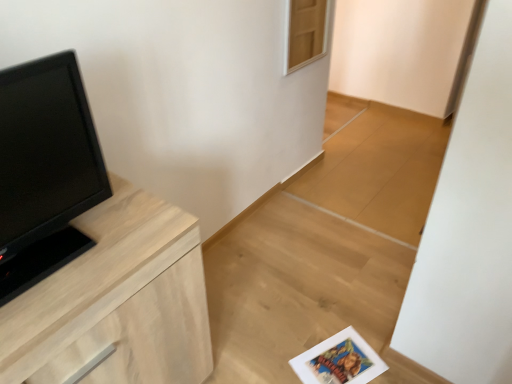
What do you see at coordinates (45, 170) in the screenshot? I see `black matte tv at left` at bounding box center [45, 170].

The height and width of the screenshot is (384, 512). In order to click on black matte tv at left in this screenshot , I will do `click(45, 170)`.

What are the coordinates of `light wood chest of drawers at left` in the screenshot? It's located at (117, 301).

What do you see at coordinates (117, 301) in the screenshot? The width and height of the screenshot is (512, 384). I see `light wood chest of drawers at left` at bounding box center [117, 301].

Consider the image. Measure the distance between light wood chest of drawers at left and camera.

The distance of light wood chest of drawers at left from camera is 30.24 inches.

The height and width of the screenshot is (384, 512). I want to click on black matte tv at left, so click(x=45, y=170).

Between black matte tv at left and light wood chest of drawers at left, which one appears on the right side from the viewer's perspective?

light wood chest of drawers at left.

Is black matte tv at left behind light wood chest of drawers at left?

No, black matte tv at left is closer to the camera.

Which point is more distant from viewer, (70, 127) or (203, 292)?

Point (203, 292)

From the image's perspective, which object appears higher, black matte tv at left or light wood chest of drawers at left?

From the image's view, black matte tv at left is above.

From a real-world perspective, is black matte tv at left above or below light wood chest of drawers at left?

In terms of real-world spatial position, black matte tv at left is above light wood chest of drawers at left.

Considering the relative sizes of black matte tv at left and light wood chest of drawers at left in the image provided, is black matte tv at left thinner than light wood chest of drawers at left?

Correct, the width of black matte tv at left is less than that of light wood chest of drawers at left.

Between black matte tv at left and light wood chest of drawers at left, which one has more height?

Standing taller between the two is light wood chest of drawers at left.

Looking at this image, looking at the image, does black matte tv at left seem bigger or smaller compared to light wood chest of drawers at left?

Clearly, black matte tv at left is smaller in size than light wood chest of drawers at left.

Is light wood chest of drawers at left completely or partially inside black matte tv at left?

No, light wood chest of drawers at left is not surrounded by black matte tv at left.

Is black matte tv at left far from light wood chest of drawers at left?

No.

Is black matte tv at left looking in the opposite direction of light wood chest of drawers at left?

No, black matte tv at left is not facing away from light wood chest of drawers at left.

How different are the orientations of black matte tv at left and light wood chest of drawers at left in degrees?

The angular difference between black matte tv at left and light wood chest of drawers at left is 2.31 degrees.

You are a GUI agent. You are given a task and a screenshot of the screen. Output one action in this format:
    pyautogui.click(x=<x>, y=<y>)
    Task: Click on the open above the light wood chest of drawers at left (from a real-world perspective)
    This screenshot has width=512, height=384.
    Given the screenshot: What is the action you would take?
    pyautogui.click(x=45, y=170)

Considering the positions of objects light wood chest of drawers at left and black matte tv at left in the image provided, who is more to the right, light wood chest of drawers at left or black matte tv at left?

Positioned to the right is light wood chest of drawers at left.

Which object is further away from the camera, light wood chest of drawers at left or black matte tv at left?

light wood chest of drawers at left is further from the camera.

Which is further, (127,318) or (22,229)?

The point (127,318) is farther from the camera.

From the image's perspective, is light wood chest of drawers at left below black matte tv at left?

Correct, light wood chest of drawers at left appears lower than black matte tv at left in the image.

From a real-world perspective, does light wood chest of drawers at left sit lower than black matte tv at left?

Yes, from a real-world perspective, light wood chest of drawers at left is under black matte tv at left.

Between light wood chest of drawers at left and black matte tv at left, which one has smaller width?

black matte tv at left.

Is light wood chest of drawers at left shorter than black matte tv at left?

No.

Considering the relative sizes of light wood chest of drawers at left and black matte tv at left in the image provided, is light wood chest of drawers at left bigger than black matte tv at left?

Correct, light wood chest of drawers at left is larger in size than black matte tv at left.

Would you say light wood chest of drawers at left is outside black matte tv at left?

Yes, light wood chest of drawers at left is located beyond the bounds of black matte tv at left.

Is light wood chest of drawers at left beside black matte tv at left?

There is a gap between light wood chest of drawers at left and black matte tv at left.

Is light wood chest of drawers at left aimed at black matte tv at left?

No, light wood chest of drawers at left is not facing towards black matte tv at left.

Identify the location of chest of drawers below the black matte tv at left (from the image's perspective). (117, 301).

Image resolution: width=512 pixels, height=384 pixels. What are the coordinates of `chest of drawers behind the black matte tv at left` in the screenshot? It's located at (117, 301).

Identify the location of open that is in front of the light wood chest of drawers at left. Image resolution: width=512 pixels, height=384 pixels. (45, 170).